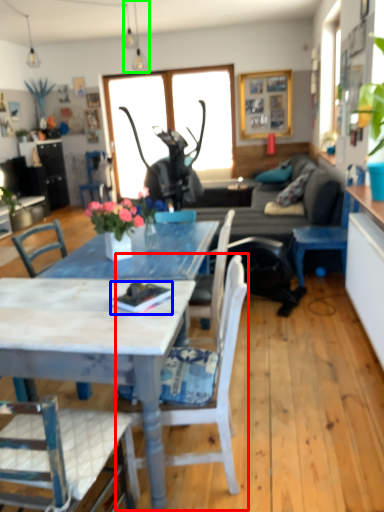
Question: Considering the real-world distances, which object is farthest from chair (highlighted by a red box)? book (highlighted by a blue box) or lamp (highlighted by a green box)?

Choices:
 (A) book
 (B) lamp

Answer: (B)